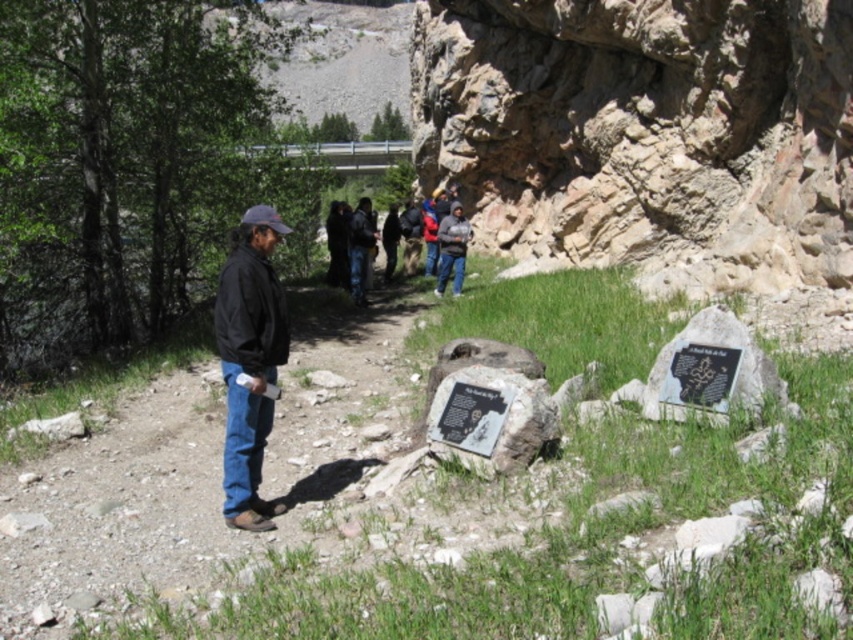
Does black matte jacket at left have a larger size compared to gray stone plaque at center?

Yes, black matte jacket at left is bigger than gray stone plaque at center.

Consider the image. Measure the distance between black matte jacket at left and camera.

The distance of black matte jacket at left from camera is 14.24 meters.

Identify the location of black matte jacket at left. This screenshot has width=853, height=640. (248, 362).

Which of these two, rocky dirt path at center or dark gray sweater at center, stands shorter?

Standing shorter between the two is rocky dirt path at center.

Does point (287, 624) come behind point (451, 236)?

No.

Is point (676, 480) farther from camera compared to point (440, 244)?

No, (676, 480) is closer to viewer.

Locate an element on the screen. The height and width of the screenshot is (640, 853). rocky dirt path at center is located at coordinates (x=431, y=493).

Does dark clothing group at center have a smaller size compared to dark blue jacket at center?

No.

Between dark clothing group at center and dark blue jacket at center, which one appears on the left side from the viewer's perspective?

From the viewer's perspective, dark blue jacket at center appears more on the left side.

Who is more distant from viewer, (358, 284) or (352, 212)?

The point (352, 212) is more distant.

Where is `dark clothing group at center`? dark clothing group at center is located at coordinates (350, 244).